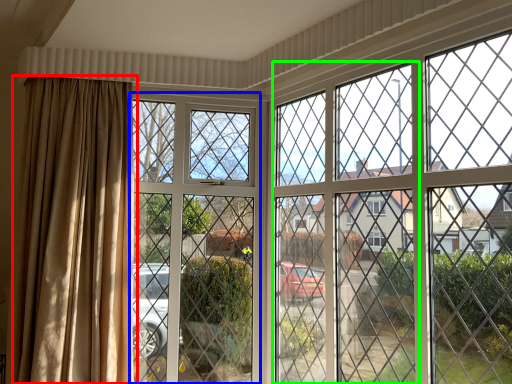
Question: Based on their relative distances, which object is nearer to curtain (highlighted by a red box)? Choose from screen door (highlighted by a blue box) and screen door (highlighted by a green box).

Choices:
 (A) screen door
 (B) screen door

Answer: (A)